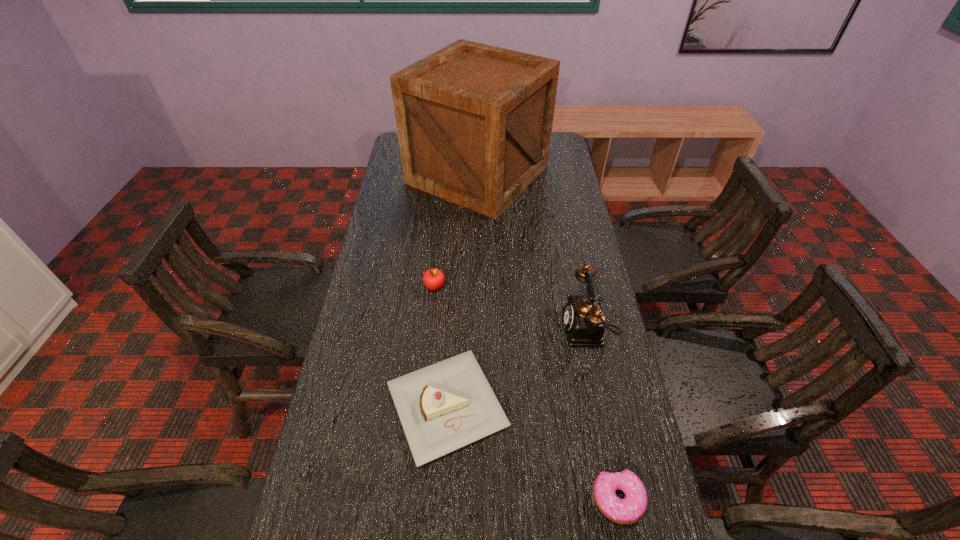
Where is `blank space located 0.280m on the front of the fourth shortest object at the rotary dial`? The width and height of the screenshot is (960, 540). blank space located 0.280m on the front of the fourth shortest object at the rotary dial is located at coordinates (465, 329).

Identify the location of free point located 0.230m on the right of the apple. The image size is (960, 540). (518, 287).

Where is `vacant space located 0.100m on the back of the cake`? vacant space located 0.100m on the back of the cake is located at coordinates (451, 325).

Identify the location of free region located on the back of the shortest object. (586, 342).

Locate an element on the screen. Image resolution: width=960 pixels, height=540 pixels. object that is at the far edge is located at coordinates (474, 122).

Where is `box located at the left edge`? This screenshot has height=540, width=960. box located at the left edge is located at coordinates (474, 122).

The image size is (960, 540). What are the coordinates of `cake that is at the left edge` in the screenshot? It's located at (443, 407).

Identify the location of box at the right edge. This screenshot has height=540, width=960. (474, 122).

Image resolution: width=960 pixels, height=540 pixels. I want to click on telephone present at the right edge, so click(584, 322).

Locate an element on the screen. This screenshot has height=540, width=960. doughnut present at the right edge is located at coordinates (632, 508).